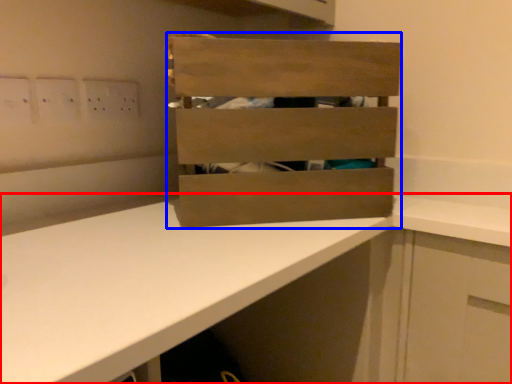
Question: Among these objects, which one is nearest to the camera, countertop (highlighted by a red box) or crate (highlighted by a blue box)?

Choices:
 (A) countertop
 (B) crate

Answer: (A)